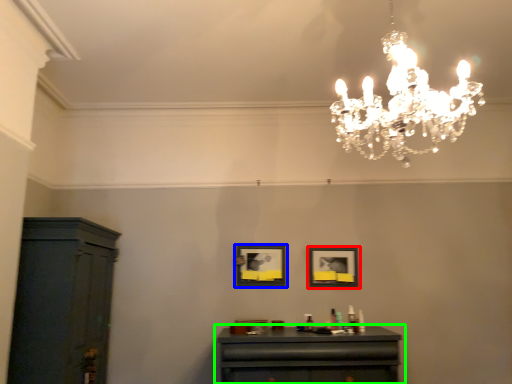
Question: Which object is positioned closest to picture frame (highlighted by a red box)? Select from picture frame (highlighted by a blue box) and table (highlighted by a green box).

Choices:
 (A) picture frame
 (B) table

Answer: (A)